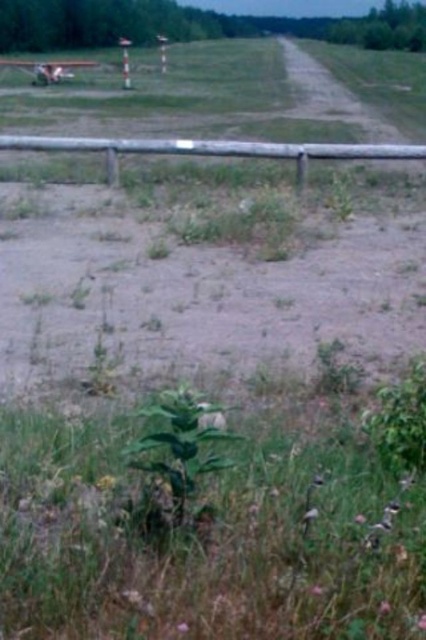
You are a drone operator trying to navigate a small drone between the green leafy grass at center and the brown wooden fence at center. Which direction should you fly the drone to move from the grass to the fence?

The green leafy grass at center is to the right of the brown wooden fence at center, so you should fly the drone to the left to move from the grass to the fence.

You are a drone operator trying to land a drone on the grassy area. The drone has a landing pad that must be placed between the green leafy grass at center and the green leafy plant at center. According to the scene description, where should you position the landing pad?

The green leafy grass at center is to the right of the green leafy plant at center, so the landing pad should be placed between them, to the right of the green leafy plant at center and left of the green leafy grass at center.

You are a drone operator trying to land your drone on the paved runway. You have two coordinates to choose from, point (43, 584) and point (192, 406). Which point is closer to you and would be safer to land on?

Point (43, 584) is closer to the camera than point (192, 406), so it would be safer to land on point (43, 584) since it is nearer to your current position.